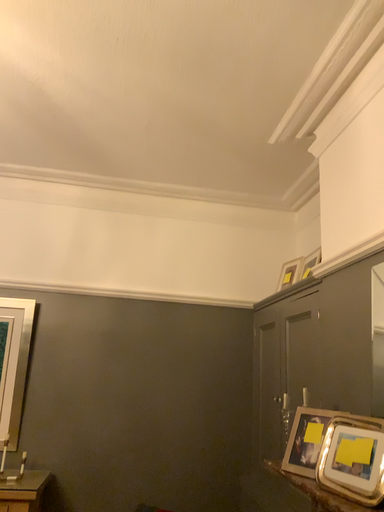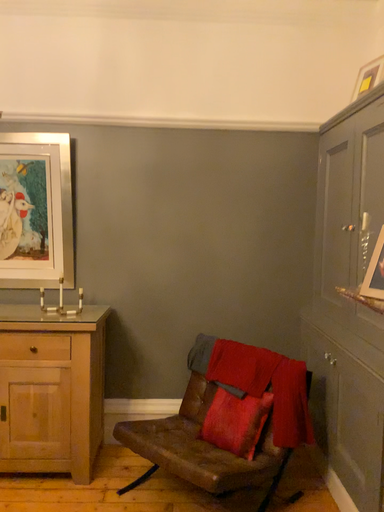
Question: Which way did the camera rotate in the video?

Choices:
 (A) rotated upward
 (B) rotated downward

Answer: (B)